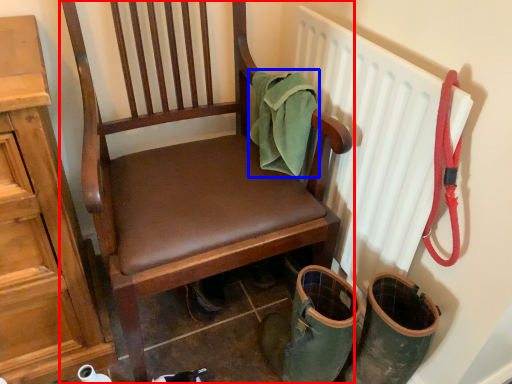
Question: Which of the following is the farthest to the observer, chair (highlighted by a red box) or material (highlighted by a blue box)?

Choices:
 (A) chair
 (B) material

Answer: (B)